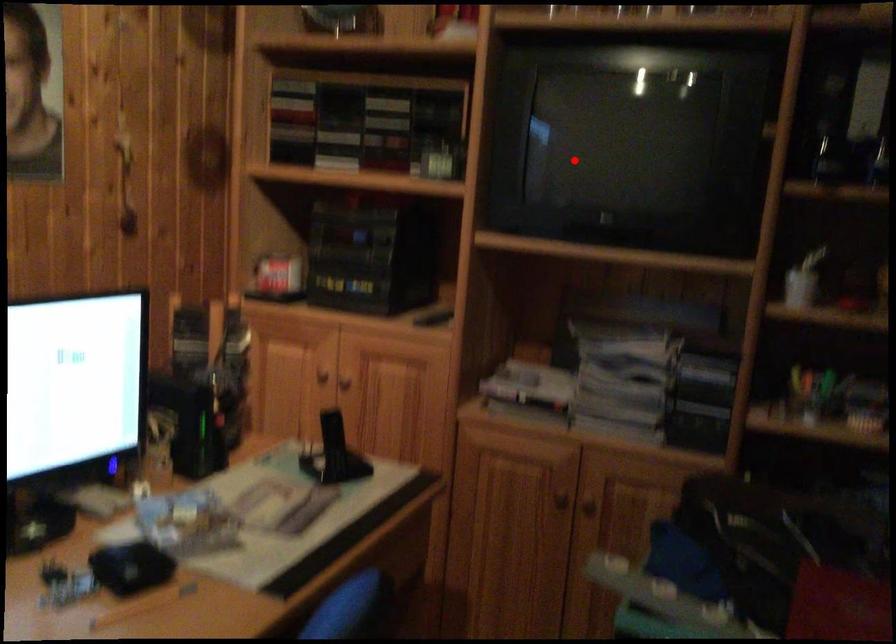
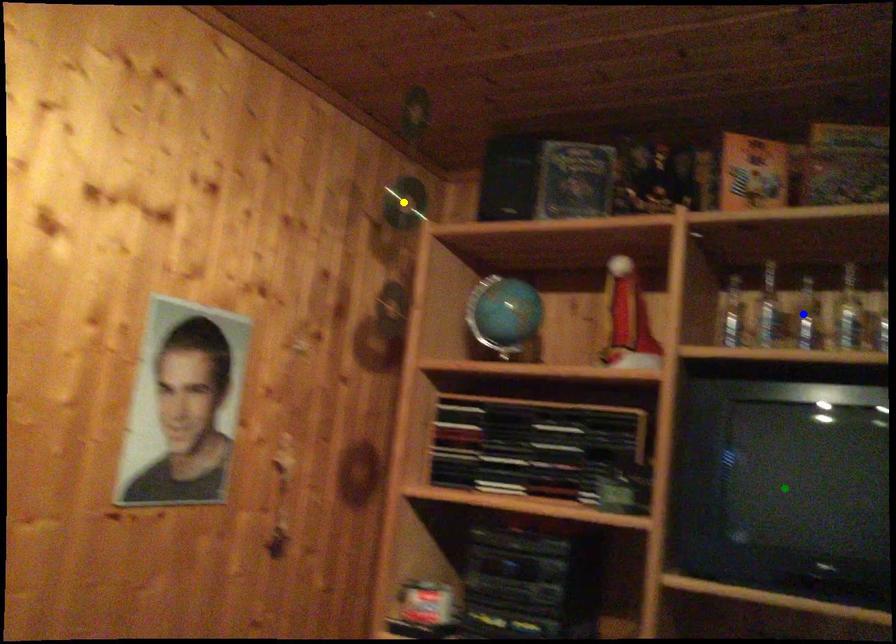
Question: I am providing you with two images of the same scene from different viewpoints. A red point is marked on the first image. You are given multiple points on the second image. Which point in image 2 represents the same 3d spot as the red point in image 1?

Choices:
 (A) green point
 (B) yellow point
 (C) blue point

Answer: (A)